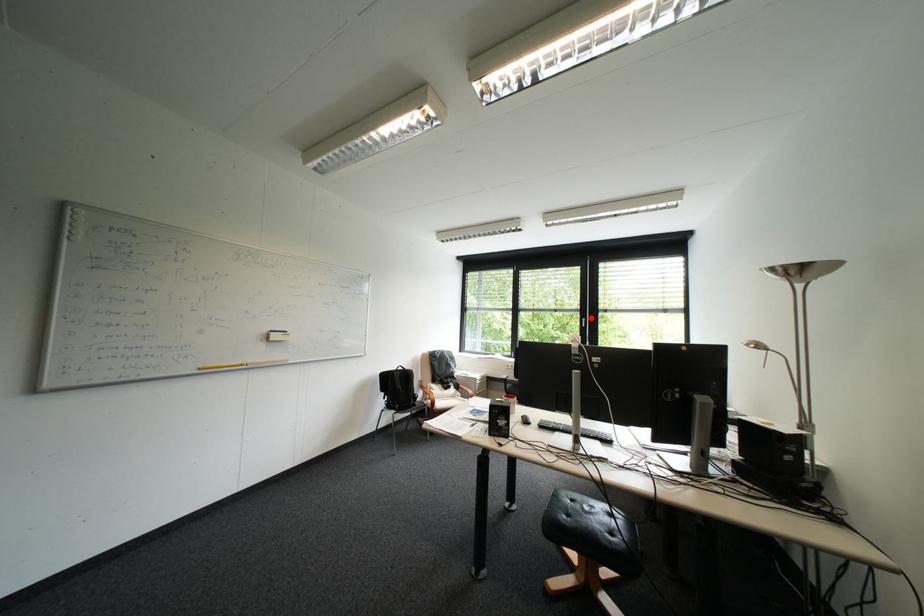
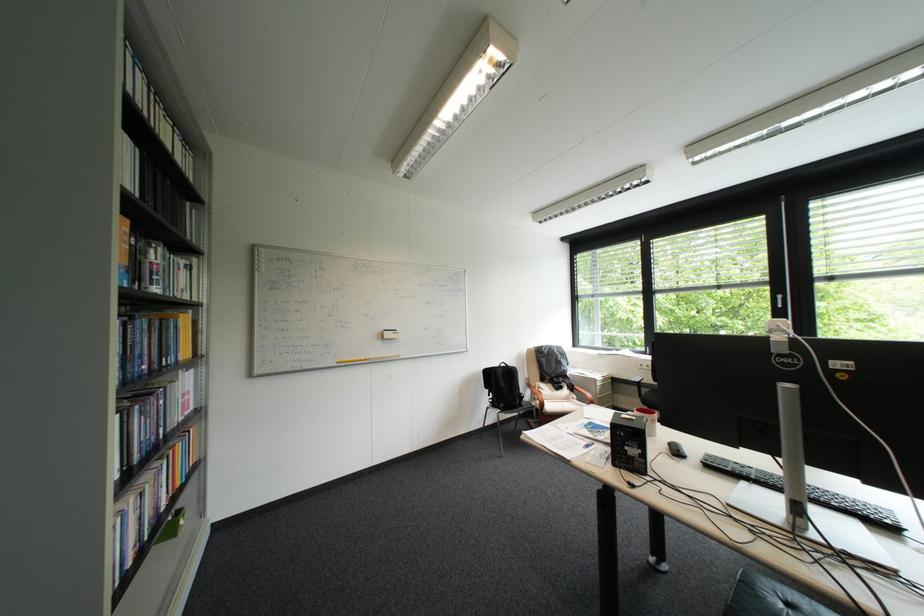
Question: A red point is marked in image1. In image2, is the corresponding 3D point closer to the camera or farther? Reply with the corresponding letter.

Choices:
 (A) The corresponding 3D point is closer.
 (B) The corresponding 3D point is farther.

Answer: (A)